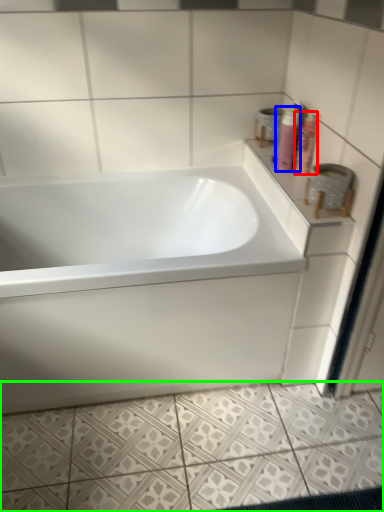
Question: Considering the real-world distances, which object is closest to shaving cream (highlighted by a red box)? shaving cream (highlighted by a blue box) or ceramic tile (highlighted by a green box).

Choices:
 (A) shaving cream
 (B) ceramic tile

Answer: (A)